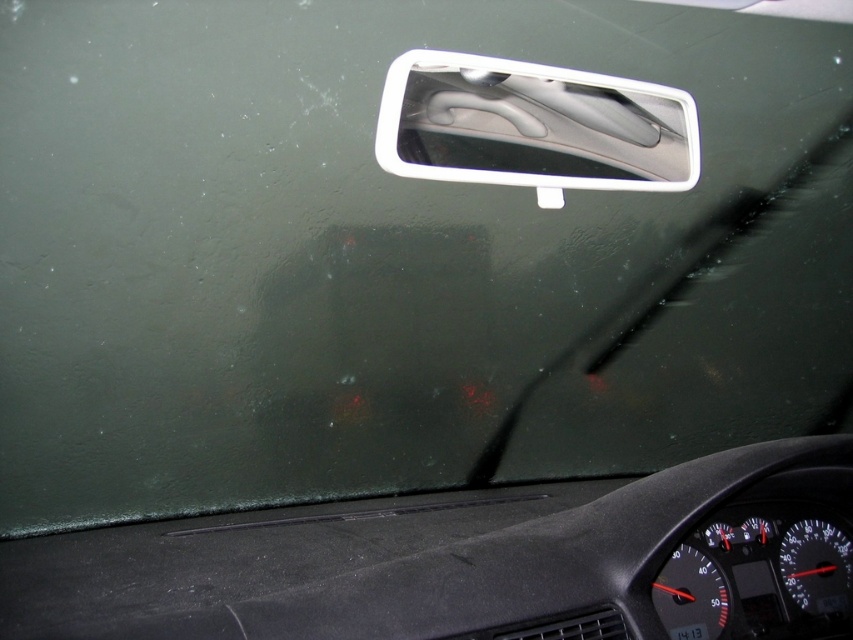
Image resolution: width=853 pixels, height=640 pixels. Describe the element at coordinates (532, 125) in the screenshot. I see `white plastic car mirror at upper center` at that location.

From the picture: Is white plastic car mirror at upper center positioned behind white plastic license plate at center?

Yes.

Between point (518, 68) and point (698, 627), which one is positioned behind?

The point (518, 68) is behind.

Where is `white plastic car mirror at upper center`? The image size is (853, 640). white plastic car mirror at upper center is located at coordinates click(532, 125).